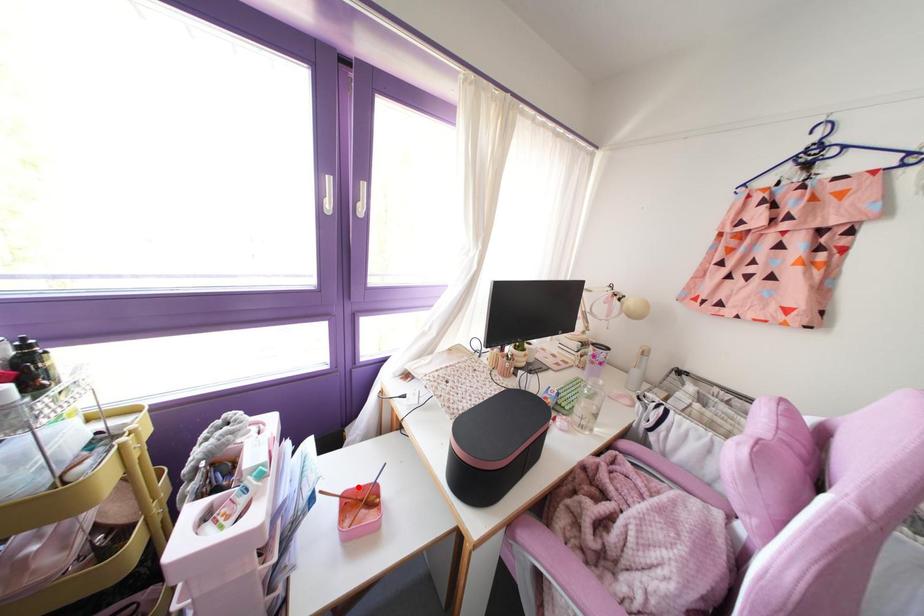
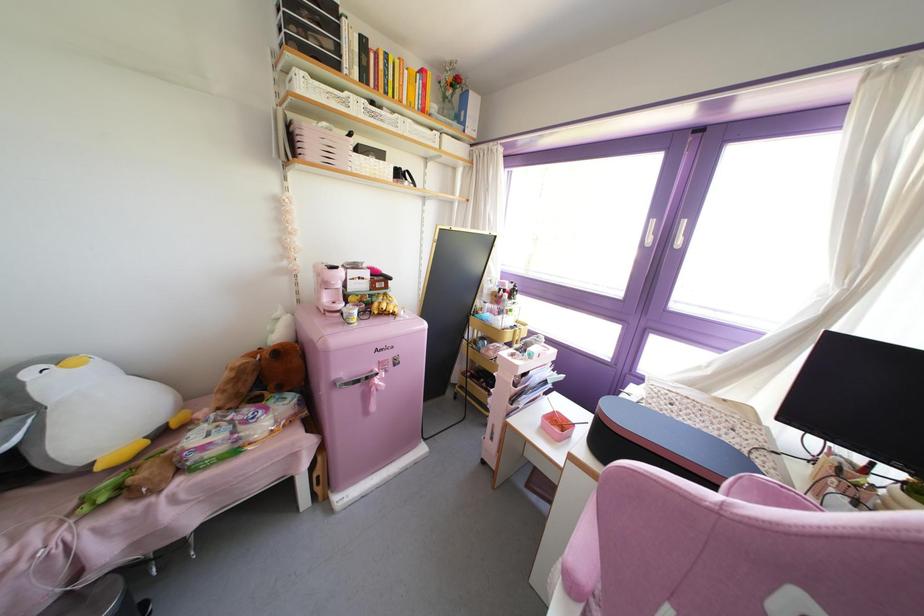
Locate, in the second image, the point that corresponds to the highlighted location in the first image.

(565, 418)